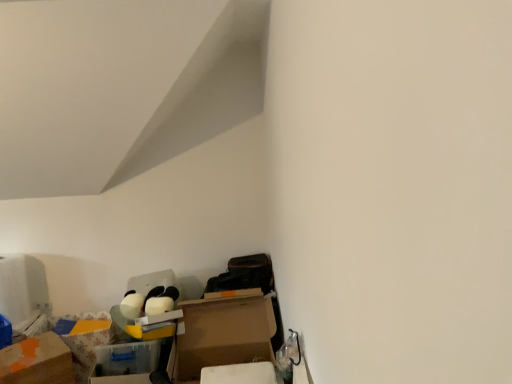
This screenshot has height=384, width=512. Describe the element at coordinates (125, 362) in the screenshot. I see `translucent plastic storage box at lower left, positioned as the 1th storage box in front-to-back order` at that location.

Find the location of `floral-patterned cardboard box at lower left, the first storage box viewed from the back`. floral-patterned cardboard box at lower left, the first storage box viewed from the back is located at coordinates (83, 342).

The height and width of the screenshot is (384, 512). I want to click on cardboard box at lower left, positioned as the 2th cardboard box in left-to-right order, so click(x=223, y=334).

Is floral-patterned cardboard box at lower left, the first storage box viewed from the back, looking in the opposite direction of orange matte cardboard box at lower left, the first cardboard box viewed from the left?

That's not correct — floral-patterned cardboard box at lower left, the first storage box viewed from the back, is not looking away from orange matte cardboard box at lower left, the first cardboard box viewed from the left.

Would you say floral-patterned cardboard box at lower left, the 2th storage box viewed from the right, is a long distance from orange matte cardboard box at lower left, which appears as the second cardboard box when viewed from the right?

No, there isn't a large distance between floral-patterned cardboard box at lower left, the 2th storage box viewed from the right, and orange matte cardboard box at lower left, which appears as the second cardboard box when viewed from the right.

How far apart are floral-patterned cardboard box at lower left, the first storage box in the left-to-right sequence, and orange matte cardboard box at lower left, the first cardboard box viewed from the left?

floral-patterned cardboard box at lower left, the first storage box in the left-to-right sequence, is 23.04 centimeters away from orange matte cardboard box at lower left, the first cardboard box viewed from the left.

Between floral-patterned cardboard box at lower left, which ranks as the 2th storage box in front-to-back order, and orange matte cardboard box at lower left, which appears as the second cardboard box when viewed from the right, which one appears on the right side from the viewer's perspective?

Positioned to the right is floral-patterned cardboard box at lower left, which ranks as the 2th storage box in front-to-back order.

Is cardboard box at lower left, positioned as the 2th cardboard box in left-to-right order, not within translucent plastic storage box at lower left, the 2th storage box viewed from the left?

Indeed, cardboard box at lower left, positioned as the 2th cardboard box in left-to-right order, is completely outside translucent plastic storage box at lower left, the 2th storage box viewed from the left.

Is point (259, 360) closer or farther from the camera than point (142, 361)?

Point (259, 360) is positioned farther from the camera compared to point (142, 361).

Considering the sizes of objects cardboard box at lower left, positioned as the 2th cardboard box in left-to-right order, and translucent plastic storage box at lower left, the first storage box from the right, in the image provided, who is wider, cardboard box at lower left, positioned as the 2th cardboard box in left-to-right order, or translucent plastic storage box at lower left, the first storage box from the right,?

With larger width is cardboard box at lower left, positioned as the 2th cardboard box in left-to-right order.

Would you say cardboard box at lower left, positioned as the 2th cardboard box in left-to-right order, is to the left or to the right of translucent plastic storage box at lower left, the first storage box from the right, in the picture?

In the image, cardboard box at lower left, positioned as the 2th cardboard box in left-to-right order, appears on the right side of translucent plastic storage box at lower left, the first storage box from the right.

Considering the relative sizes of orange matte cardboard box at lower left, the first cardboard box viewed from the left, and floral-patterned cardboard box at lower left, the first storage box in the left-to-right sequence, in the image provided, is orange matte cardboard box at lower left, the first cardboard box viewed from the left, bigger than floral-patterned cardboard box at lower left, the first storage box in the left-to-right sequence,?

Correct, orange matte cardboard box at lower left, the first cardboard box viewed from the left, is larger in size than floral-patterned cardboard box at lower left, the first storage box in the left-to-right sequence.

Considering the relative sizes of orange matte cardboard box at lower left, the first cardboard box viewed from the left, and floral-patterned cardboard box at lower left, the first storage box in the left-to-right sequence, in the image provided, is orange matte cardboard box at lower left, the first cardboard box viewed from the left, wider than floral-patterned cardboard box at lower left, the first storage box in the left-to-right sequence,?

No, orange matte cardboard box at lower left, the first cardboard box viewed from the left, is not wider than floral-patterned cardboard box at lower left, the first storage box in the left-to-right sequence.

Does orange matte cardboard box at lower left, the first cardboard box viewed from the left, turn towards floral-patterned cardboard box at lower left, the first storage box in the left-to-right sequence?

No, orange matte cardboard box at lower left, the first cardboard box viewed from the left, is not aimed at floral-patterned cardboard box at lower left, the first storage box in the left-to-right sequence.

From a real-world perspective, which is physically below, cardboard box at lower left, arranged as the first cardboard box when viewed from the right, or floral-patterned cardboard box at lower left, the first storage box in the left-to-right sequence?

floral-patterned cardboard box at lower left, the first storage box in the left-to-right sequence, from a real-world perspective.

Considering the positions of objects cardboard box at lower left, arranged as the first cardboard box when viewed from the right, and floral-patterned cardboard box at lower left, which ranks as the 2th storage box in front-to-back order, in the image provided, who is more to the right, cardboard box at lower left, arranged as the first cardboard box when viewed from the right, or floral-patterned cardboard box at lower left, which ranks as the 2th storage box in front-to-back order,?

From the viewer's perspective, cardboard box at lower left, arranged as the first cardboard box when viewed from the right, appears more on the right side.

From the image's perspective, relative to floral-patterned cardboard box at lower left, which ranks as the 2th storage box in front-to-back order, is cardboard box at lower left, arranged as the first cardboard box when viewed from the right, above or below?

cardboard box at lower left, arranged as the first cardboard box when viewed from the right, is situated higher than floral-patterned cardboard box at lower left, which ranks as the 2th storage box in front-to-back order, in the image.

Between cardboard box at lower left, arranged as the first cardboard box when viewed from the right, and floral-patterned cardboard box at lower left, which ranks as the 2th storage box in front-to-back order, which one is positioned behind?

floral-patterned cardboard box at lower left, which ranks as the 2th storage box in front-to-back order, is further away from the camera.

Is orange matte cardboard box at lower left, the first cardboard box viewed from the left, facing towards translucent plastic storage box at lower left, the first storage box from the right?

Yes, orange matte cardboard box at lower left, the first cardboard box viewed from the left, is turned towards translucent plastic storage box at lower left, the first storage box from the right.

Considering the relative sizes of orange matte cardboard box at lower left, the first cardboard box viewed from the left, and translucent plastic storage box at lower left, the first storage box from the right, in the image provided, is orange matte cardboard box at lower left, the first cardboard box viewed from the left, taller than translucent plastic storage box at lower left, the first storage box from the right,?

Yes, orange matte cardboard box at lower left, the first cardboard box viewed from the left, is taller than translucent plastic storage box at lower left, the first storage box from the right.

From a real-world perspective, is orange matte cardboard box at lower left, which appears as the second cardboard box when viewed from the right, above or below translucent plastic storage box at lower left, positioned as the 1th storage box in front-to-back order?

orange matte cardboard box at lower left, which appears as the second cardboard box when viewed from the right, is situated lower than translucent plastic storage box at lower left, positioned as the 1th storage box in front-to-back order, in the real world.

Can you confirm if orange matte cardboard box at lower left, the first cardboard box viewed from the left, is positioned to the right of translucent plastic storage box at lower left, which ranks as the 2th storage box in back-to-front order?

In fact, orange matte cardboard box at lower left, the first cardboard box viewed from the left, is to the left of translucent plastic storage box at lower left, which ranks as the 2th storage box in back-to-front order.

Is floral-patterned cardboard box at lower left, the first storage box in the left-to-right sequence, at the left side of translucent plastic storage box at lower left, the 2th storage box viewed from the left?

Yes, floral-patterned cardboard box at lower left, the first storage box in the left-to-right sequence, is to the left of translucent plastic storage box at lower left, the 2th storage box viewed from the left.

Can you confirm if floral-patterned cardboard box at lower left, the first storage box viewed from the back, is taller than translucent plastic storage box at lower left, positioned as the 1th storage box in front-to-back order?

No.

This screenshot has width=512, height=384. I want to click on storage box that is under the translucent plastic storage box at lower left, positioned as the 1th storage box in front-to-back order (from a real-world perspective), so click(83, 342).

Does cardboard box at lower left, arranged as the first cardboard box when viewed from the right, lie behind orange matte cardboard box at lower left, which appears as the second cardboard box when viewed from the right?

No, cardboard box at lower left, arranged as the first cardboard box when viewed from the right, is closer to the camera.

Is cardboard box at lower left, positioned as the 2th cardboard box in left-to-right order, aimed at orange matte cardboard box at lower left, the first cardboard box viewed from the left?

No, cardboard box at lower left, positioned as the 2th cardboard box in left-to-right order, is not aimed at orange matte cardboard box at lower left, the first cardboard box viewed from the left.

How different are the orientations of cardboard box at lower left, arranged as the first cardboard box when viewed from the right, and orange matte cardboard box at lower left, the first cardboard box viewed from the left, in degrees?

There is a 40.4-degree angle between the facing directions of cardboard box at lower left, arranged as the first cardboard box when viewed from the right, and orange matte cardboard box at lower left, the first cardboard box viewed from the left.

Considering the relative sizes of cardboard box at lower left, arranged as the first cardboard box when viewed from the right, and orange matte cardboard box at lower left, the first cardboard box viewed from the left, in the image provided, is cardboard box at lower left, arranged as the first cardboard box when viewed from the right, wider than orange matte cardboard box at lower left, the first cardboard box viewed from the left,?

Yes.

Where is `storage box that is the 1st one when counting upward from the orange matte cardboard box at lower left, which appears as the second cardboard box when viewed from the right (from the image's perspective)`? The height and width of the screenshot is (384, 512). storage box that is the 1st one when counting upward from the orange matte cardboard box at lower left, which appears as the second cardboard box when viewed from the right (from the image's perspective) is located at coordinates (83, 342).

In order to click on storage box located above the cardboard box at lower left, arranged as the first cardboard box when viewed from the right (from a real-world perspective) in this screenshot , I will do pos(125,362).

Based on their spatial positions, is translucent plastic storage box at lower left, positioned as the 1th storage box in front-to-back order, or floral-patterned cardboard box at lower left, the first storage box viewed from the back, closer to orange matte cardboard box at lower left, the first cardboard box viewed from the left?

floral-patterned cardboard box at lower left, the first storage box viewed from the back, lies closer to orange matte cardboard box at lower left, the first cardboard box viewed from the left, than the other object.

Which object lies further to the anchor point floral-patterned cardboard box at lower left, the first storage box in the left-to-right sequence, orange matte cardboard box at lower left, the first cardboard box viewed from the left, or translucent plastic storage box at lower left, the first storage box from the right?

Based on the image, translucent plastic storage box at lower left, the first storage box from the right, appears to be further to floral-patterned cardboard box at lower left, the first storage box in the left-to-right sequence.

Estimate the real-world distances between objects in this image. Which object is closer to translucent plastic storage box at lower left, the 2th storage box viewed from the left, orange matte cardboard box at lower left, which appears as the second cardboard box when viewed from the right, or cardboard box at lower left, arranged as the first cardboard box when viewed from the right?

cardboard box at lower left, arranged as the first cardboard box when viewed from the right, lies closer to translucent plastic storage box at lower left, the 2th storage box viewed from the left, than the other object.

Looking at the image, which one is located closer to cardboard box at lower left, arranged as the first cardboard box when viewed from the right, floral-patterned cardboard box at lower left, the first storage box viewed from the back, or orange matte cardboard box at lower left, the first cardboard box viewed from the left?

Among the two, floral-patterned cardboard box at lower left, the first storage box viewed from the back, is located nearer to cardboard box at lower left, arranged as the first cardboard box when viewed from the right.

Based on the photo, considering their positions, is translucent plastic storage box at lower left, positioned as the 1th storage box in front-to-back order, positioned further to orange matte cardboard box at lower left, which appears as the second cardboard box when viewed from the right, than cardboard box at lower left, arranged as the first cardboard box when viewed from the right?

cardboard box at lower left, arranged as the first cardboard box when viewed from the right, is positioned further to the anchor orange matte cardboard box at lower left, which appears as the second cardboard box when viewed from the right.

Considering their positions, is floral-patterned cardboard box at lower left, which ranks as the 2th storage box in front-to-back order, positioned closer to orange matte cardboard box at lower left, the first cardboard box viewed from the left, than cardboard box at lower left, arranged as the first cardboard box when viewed from the right?

The object closer to orange matte cardboard box at lower left, the first cardboard box viewed from the left, is floral-patterned cardboard box at lower left, which ranks as the 2th storage box in front-to-back order.

Based on their spatial positions, is cardboard box at lower left, positioned as the 2th cardboard box in left-to-right order, or floral-patterned cardboard box at lower left, the 2th storage box viewed from the right, closer to translucent plastic storage box at lower left, which ranks as the 2th storage box in back-to-front order?

cardboard box at lower left, positioned as the 2th cardboard box in left-to-right order, lies closer to translucent plastic storage box at lower left, which ranks as the 2th storage box in back-to-front order, than the other object.

Which object lies further to the anchor point floral-patterned cardboard box at lower left, the first storage box in the left-to-right sequence, cardboard box at lower left, positioned as the 2th cardboard box in left-to-right order, or orange matte cardboard box at lower left, which appears as the second cardboard box when viewed from the right?

Among the two, cardboard box at lower left, positioned as the 2th cardboard box in left-to-right order, is located further to floral-patterned cardboard box at lower left, the first storage box in the left-to-right sequence.

Where is `storage box located between orange matte cardboard box at lower left, the first cardboard box viewed from the left, and translucent plastic storage box at lower left, the 2th storage box viewed from the left, in the left-right direction`? Image resolution: width=512 pixels, height=384 pixels. storage box located between orange matte cardboard box at lower left, the first cardboard box viewed from the left, and translucent plastic storage box at lower left, the 2th storage box viewed from the left, in the left-right direction is located at coordinates (83, 342).

Find the location of a particular element. storage box between floral-patterned cardboard box at lower left, the first storage box viewed from the back, and cardboard box at lower left, positioned as the 2th cardboard box in left-to-right order, from left to right is located at coordinates (125, 362).